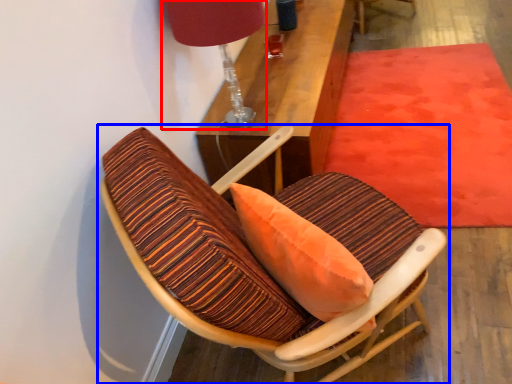
Question: Which object appears farthest to the camera in this image, table lamp (highlighted by a red box) or chair (highlighted by a blue box)?

Choices:
 (A) table lamp
 (B) chair

Answer: (A)